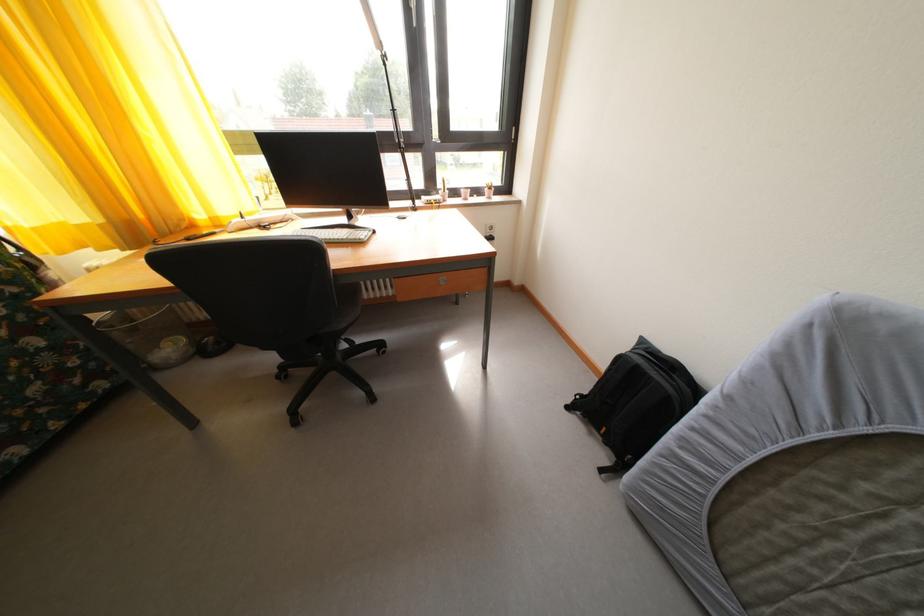
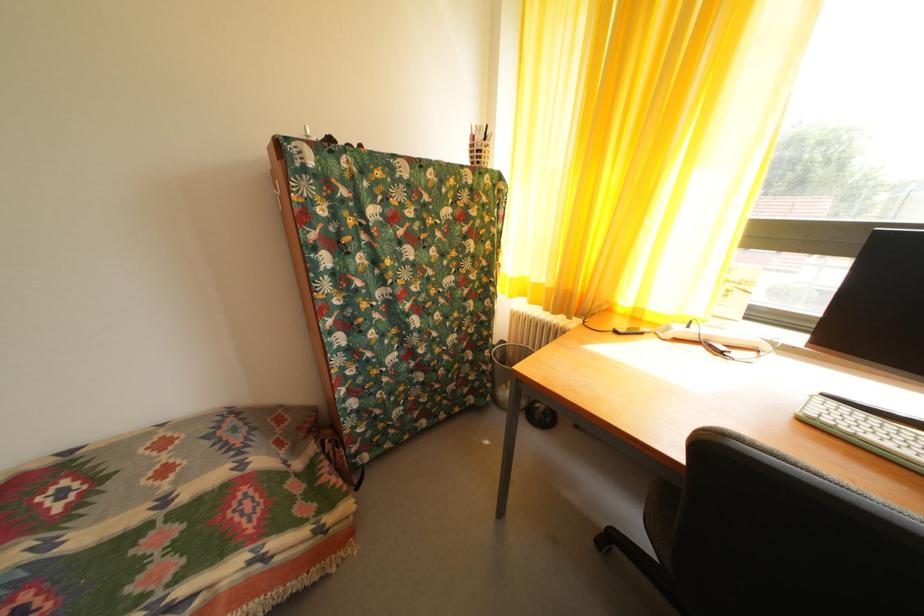
Question: The camera is either moving clockwise (left) or counter-clockwise (right) around the object. The first image is from the beginning of the video and the second image is from the end. Is the camera moving left or right when shooting the video?

Choices:
 (A) Left
 (B) Right

Answer: (B)